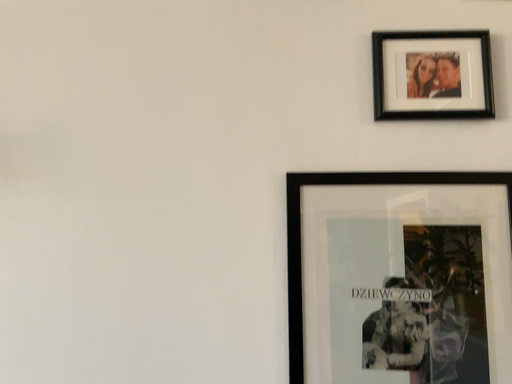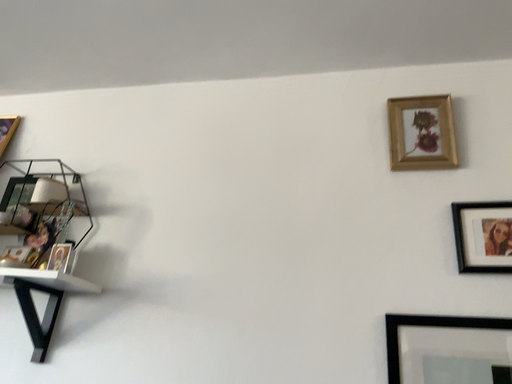
Question: How did the camera likely rotate when shooting the video?

Choices:
 (A) rotated left
 (B) rotated right

Answer: (A)